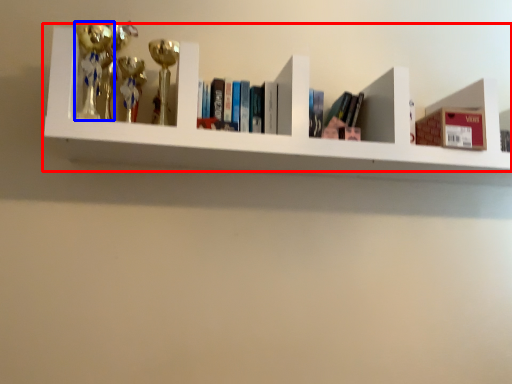
Question: Which object is closer to the camera taking this photo, shelf (highlighted by a red box) or toy (highlighted by a blue box)?

Choices:
 (A) shelf
 (B) toy

Answer: (A)